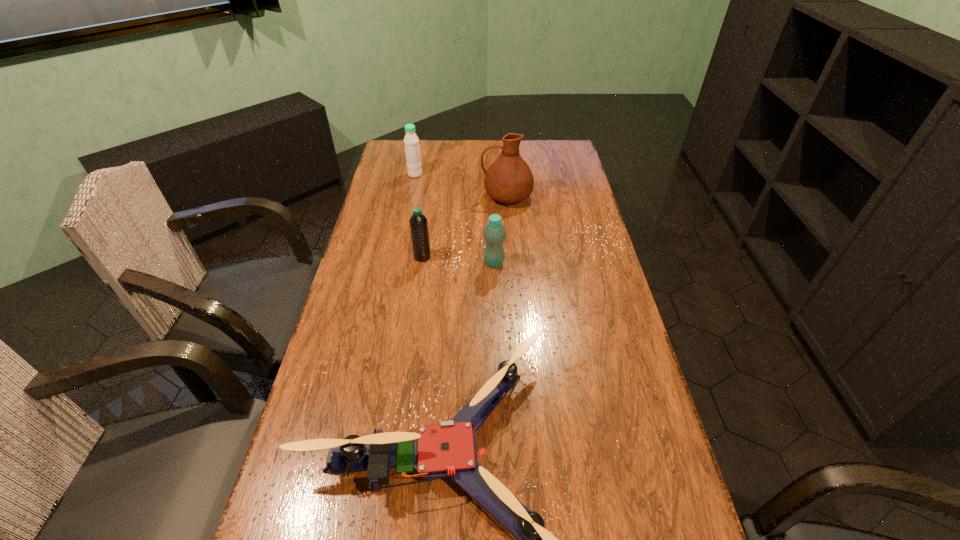
You are a GUI agent. You are given a task and a screenshot of the screen. Output one action in this format:
    pyautogui.click(x=<x>, y=<y>)
    Task: Click on the tallest object
    The width and height of the screenshot is (960, 540).
    Given the screenshot: What is the action you would take?
    pyautogui.click(x=509, y=180)

The image size is (960, 540). In order to click on the fourth nearest object in this screenshot , I will do `click(509, 180)`.

Locate an element on the screen. the farthest water bottle is located at coordinates (411, 142).

Image resolution: width=960 pixels, height=540 pixels. Find the location of `the farthest object`. the farthest object is located at coordinates (411, 142).

The height and width of the screenshot is (540, 960). What are the coordinates of `the second water bottle from right to left` in the screenshot? It's located at (418, 223).

Find the location of a particular element. Image resolution: width=960 pixels, height=540 pixels. the rightmost water bottle is located at coordinates (494, 233).

Image resolution: width=960 pixels, height=540 pixels. Find the location of `vacant region located on the side of the fourth nearest object with the handle`. vacant region located on the side of the fourth nearest object with the handle is located at coordinates (410, 197).

This screenshot has width=960, height=540. I want to click on free space located 0.260m on the side of the fourth nearest object with the handle, so click(413, 197).

Identify the location of vacant area situated 0.370m on the side of the fourth nearest object with the handle. (384, 197).

I want to click on vacant space located 0.060m on the right of the farthest water bottle, so click(x=437, y=174).